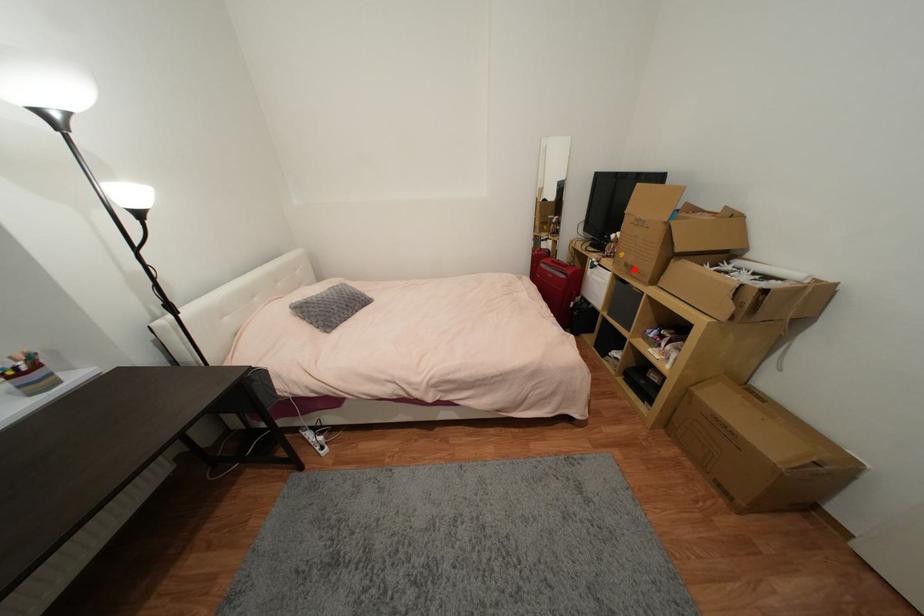
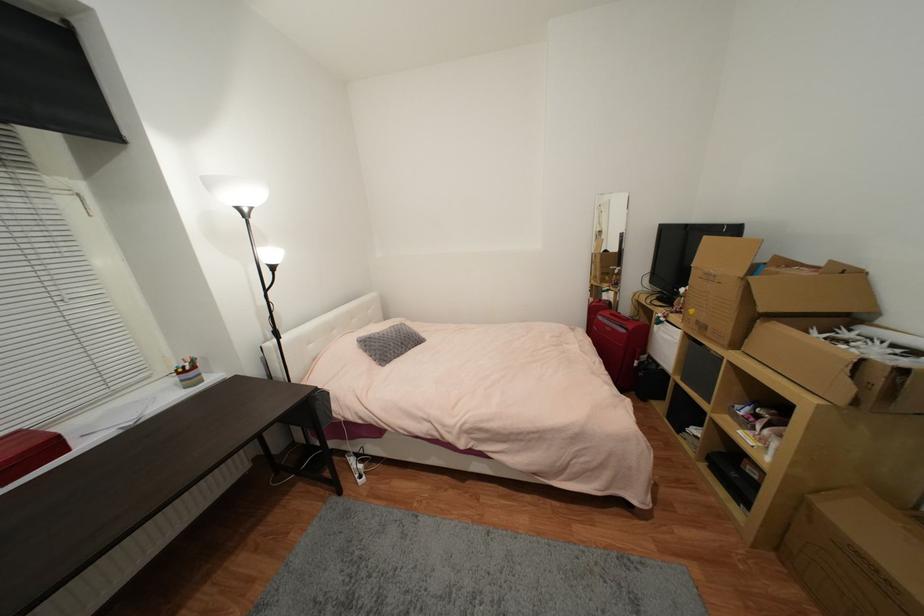
Find the pixel in the second image that matches the highlighted location in the first image.

(708, 329)